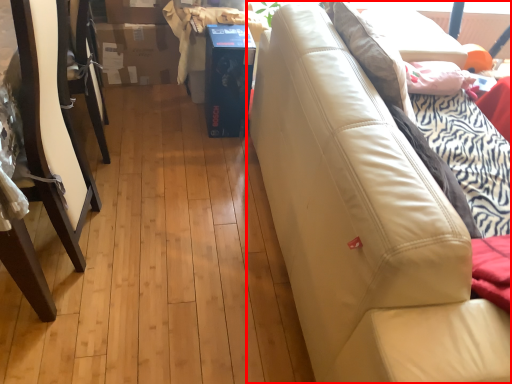
Question: From the image's perspective, what is the correct spatial relationship of studio couch (annotated by the red box) in relation to furniture?

Choices:
 (A) below
 (B) above

Answer: (A)